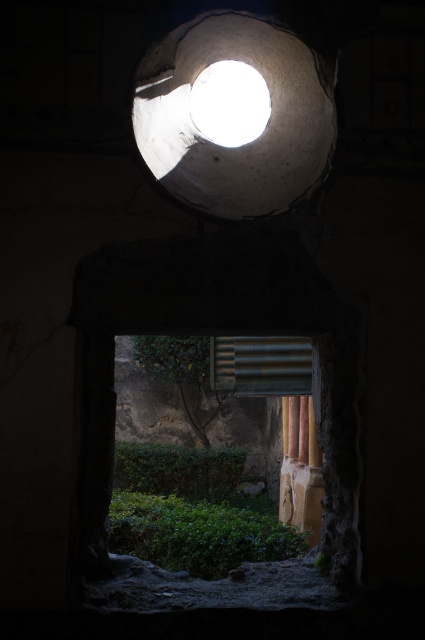
You are an architect designing a new building and want to replicate the lighting effect seen through the circular opening. You have two elements in your design, the white matte light at upper center and the smooth stone pillar at right. Based on their positions, which object is further to the left when viewed from the entrance?

The white matte light at upper center is positioned on the left side of smooth stone pillar at right, so it is further to the left when viewed from the entrance.

You are an architect designing a new building and want to ensure that the white matte light at upper center and the smooth stone pillar at right do not block each other. Based on their sizes, which one is shorter?

The white matte light at upper center is shorter than the smooth stone pillar at right according to the description.